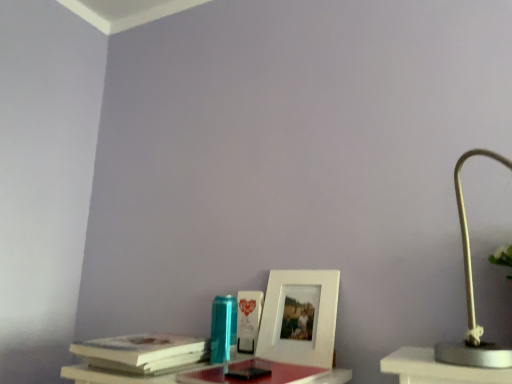
Where is `white matte picture frame at center`? Image resolution: width=512 pixels, height=384 pixels. white matte picture frame at center is located at coordinates (298, 317).

At what (x,y) coordinates should I click in order to perform the action: click on white paper at left. Please return your answer as a coordinate pair (x, y). Looking at the image, I should click on (143, 352).

This screenshot has height=384, width=512. I want to click on white matte lamp at right, so click(472, 294).

Locate an element on the screen. This screenshot has width=512, height=384. white matte picture frame at center is located at coordinates (298, 317).

From the image's perspective, which is below, white paper at left or white matte lamp at right?

white paper at left, from the image's perspective.

Is white paper at left closer to the viewer compared to white matte lamp at right?

That is False.

How many degrees apart are the facing directions of white paper at left and white matte lamp at right?

They differ by 1.32 degrees in their facing directions.

From the picture: In terms of size, does white paper at left appear bigger or smaller than white matte lamp at right?

Considering their sizes, white paper at left takes up less space than white matte lamp at right.

Between white matte picture frame at center and white paper at left, which one is positioned behind?

white matte picture frame at center is behind.

Is white matte picture frame at center bigger or smaller than white paper at left?

white matte picture frame at center is smaller than white paper at left.

Would you consider white matte picture frame at center to be distant from white paper at left?

No, there isn't a large distance between white matte picture frame at center and white paper at left.

Is smooth plastic table at lower center oriented away from white paper at left?

No, smooth plastic table at lower center is not facing the opposite direction of white paper at left.

From a real-world perspective, is smooth plastic table at lower center physically located above or below white paper at left?

smooth plastic table at lower center is below white paper at left.

Locate an element on the screen. The height and width of the screenshot is (384, 512). table on the right of white paper at left is located at coordinates (111, 376).

From the picture: From a real-world perspective, is white matte lamp at right over white matte picture frame at center?

Yes, from a real-world perspective, white matte lamp at right is above white matte picture frame at center.

Which is in front, point (455, 182) or point (328, 277)?

The point (455, 182) is closer.

Are white matte lamp at right and white matte picture frame at center far apart?

That's not correct — white matte lamp at right is a little close to white matte picture frame at center.

How many degrees apart are the facing directions of white paper at left and smooth plastic table at lower center?

6.71 degrees separate the facing orientations of white paper at left and smooth plastic table at lower center.

Is white paper at left not close to smooth plastic table at lower center?

No, there isn't a large distance between white paper at left and smooth plastic table at lower center.

Does white paper at left have a greater width compared to smooth plastic table at lower center?

No, white paper at left is not wider than smooth plastic table at lower center.

Can you confirm if white paper at left is shorter than smooth plastic table at lower center?

Incorrect, the height of white paper at left does not fall short of that of smooth plastic table at lower center.

From the image's perspective, is smooth plastic table at lower center located above white matte lamp at right?

Actually, smooth plastic table at lower center appears below white matte lamp at right in the image.

Identify the location of lamp above the smooth plastic table at lower center (from the image's perspective). (472, 294).

Is smooth plastic table at lower center with white matte lamp at right?

No, smooth plastic table at lower center is not next to white matte lamp at right.

Which object is thinner, smooth plastic table at lower center or white matte lamp at right?

white matte lamp at right.

Considering the relative positions of white matte lamp at right and smooth plastic table at lower center in the image provided, is white matte lamp at right behind smooth plastic table at lower center?

No, it is in front of smooth plastic table at lower center.

Which of these two, white matte lamp at right or smooth plastic table at lower center, is smaller?

Smaller between the two is smooth plastic table at lower center.

Is white matte lamp at right to the left of smooth plastic table at lower center from the viewer's perspective?

No, white matte lamp at right is not to the left of smooth plastic table at lower center.

You are a GUI agent. You are given a task and a screenshot of the screen. Output one action in this format:
    pyautogui.click(x=<x>, y=<y>)
    Task: Click on the table directly beneath the white matte lamp at right (from a real-world perspective)
    The height and width of the screenshot is (384, 512).
    Given the screenshot: What is the action you would take?
    pyautogui.click(x=111, y=376)

Locate an element on the screen. The height and width of the screenshot is (384, 512). lamp above the white paper at left (from the image's perspective) is located at coordinates (472, 294).

Identify the location of paperback book below the white matte picture frame at center (from the image's perspective). (143, 352).

Based on their spatial positions, is white paper at left or white matte lamp at right further from white matte picture frame at center?

white matte lamp at right is further to white matte picture frame at center.

When comparing their distances from white paper at left, does white matte picture frame at center or white matte lamp at right seem closer?

Among the two, white matte picture frame at center is located nearer to white paper at left.

Looking at the image, which one is located further to white matte lamp at right, white paper at left or white matte picture frame at center?

white paper at left is further to white matte lamp at right.

When comparing their distances from white paper at left, does white matte lamp at right or smooth plastic table at lower center seem further?

white matte lamp at right is further to white paper at left.

When comparing their distances from white matte picture frame at center, does smooth plastic table at lower center or white paper at left seem further?

white paper at left.

From the image, which object appears to be farther from white paper at left, white matte picture frame at center or smooth plastic table at lower center?

Based on the image, white matte picture frame at center appears to be further to white paper at left.

In the scene shown: Which object lies nearer to the anchor point smooth plastic table at lower center, white matte lamp at right or white matte picture frame at center?

white matte picture frame at center is closer to smooth plastic table at lower center.

Estimate the real-world distances between objects in this image. Which object is further from smooth plastic table at lower center, white matte lamp at right or white paper at left?

white matte lamp at right is positioned further to the anchor smooth plastic table at lower center.

At what (x,y) coordinates should I click in order to perform the action: click on table positioned between white matte lamp at right and white matte picture frame at center from near to far. Please return your answer as a coordinate pair (x, y). This screenshot has height=384, width=512. Looking at the image, I should click on (111, 376).

Where is `table located between white paper at left and white matte picture frame at center in the left-right direction`? Image resolution: width=512 pixels, height=384 pixels. table located between white paper at left and white matte picture frame at center in the left-right direction is located at coordinates (111, 376).

Locate an element on the screen. table between white paper at left and white matte lamp at right in the horizontal direction is located at coordinates (111, 376).

At what (x,y) coordinates should I click in order to perform the action: click on picture frame between white paper at left and white matte lamp at right in the horizontal direction. Please return your answer as a coordinate pair (x, y). This screenshot has width=512, height=384. Looking at the image, I should click on (298, 317).